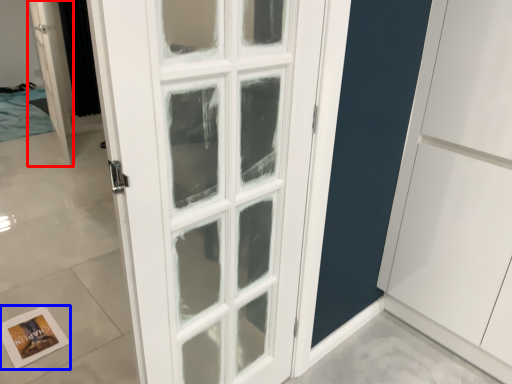
Question: Which object appears closest to the camera in this image, door (highlighted by a red box) or postcard (highlighted by a blue box)?

Choices:
 (A) door
 (B) postcard

Answer: (B)